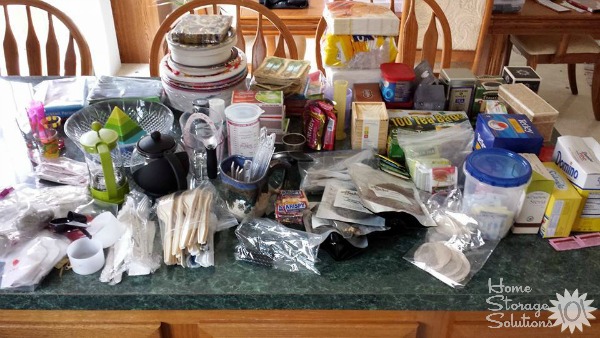
Locate an element on the screen. table is located at coordinates (345, 262).